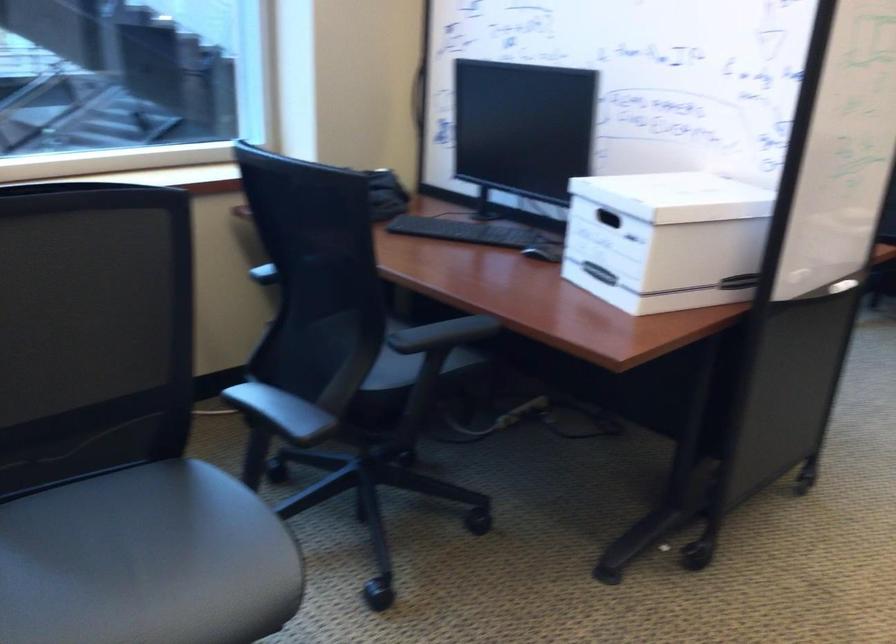
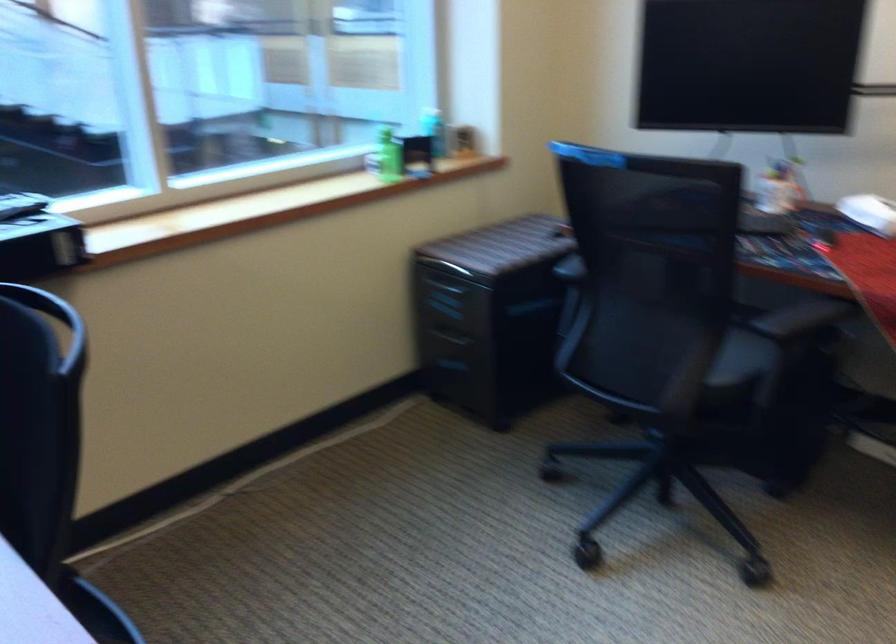
In a continuous first-person perspective shot, in which direction is the camera moving?

The movement direction of the cameraman is right, forward.